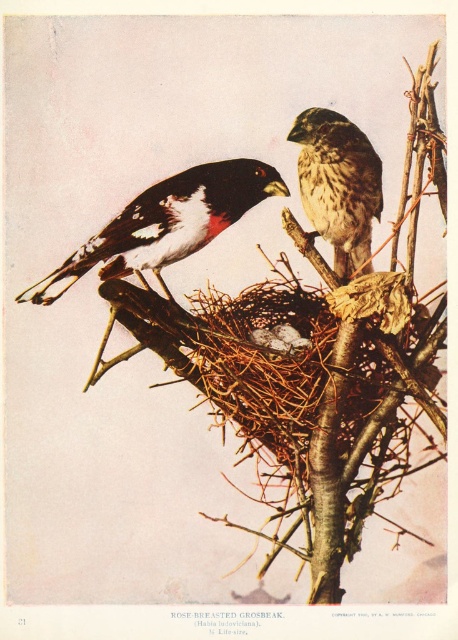
Question: Estimate the real-world distances between objects in this image. Which object is farther from the brown speckled feathers at upper center?

Choices:
 (A) black and white speckled bird at center
 (B) brown twigs at center

Answer: (A)

Question: Which of the following is the closest to the observer?

Choices:
 (A) (288, 195)
 (B) (327, 161)

Answer: (A)

Question: Can you confirm if brown twigs at center is smaller than brown speckled feathers at upper center?

Choices:
 (A) yes
 (B) no

Answer: (B)

Question: Is brown twigs at center positioned at the back of brown speckled feathers at upper center?

Choices:
 (A) yes
 (B) no

Answer: (B)

Question: Is brown twigs at center to the right of black and white speckled bird at center from the viewer's perspective?

Choices:
 (A) yes
 (B) no

Answer: (A)

Question: Which of the following is the farthest from the observer?

Choices:
 (A) brown twigs at center
 (B) black and white speckled bird at center
 (C) brown speckled feathers at upper center

Answer: (C)